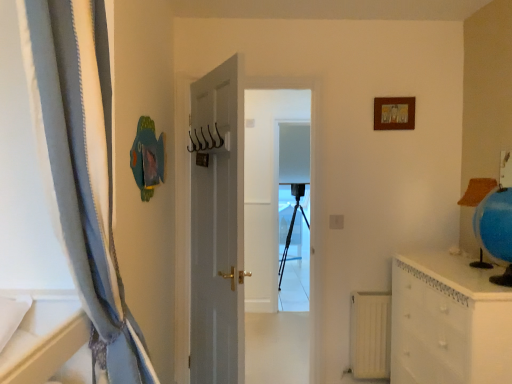
Question: Does point (393, 359) appear closer or farther from the camera than point (359, 292)?

Choices:
 (A) farther
 (B) closer

Answer: (B)

Question: Is white glossy chest of drawers at right spatially inside white matte radiator at lower right, or outside of it?

Choices:
 (A) inside
 (B) outside

Answer: (B)

Question: Estimate the real-world distances between objects in this image. Which object is closer to the white glossy chest of drawers at right?

Choices:
 (A) white matte radiator at lower right
 (B) black matte tripod at center
 (C) white glossy door at center
 (D) blue fabric curtain at left
 (E) metallic hooks at center

Answer: (A)

Question: Which is farther from the white matte radiator at lower right?

Choices:
 (A) black matte tripod at center
 (B) white glossy chest of drawers at right
 (C) metallic hooks at center
 (D) white glossy door at center
 (E) blue fabric curtain at left

Answer: (A)